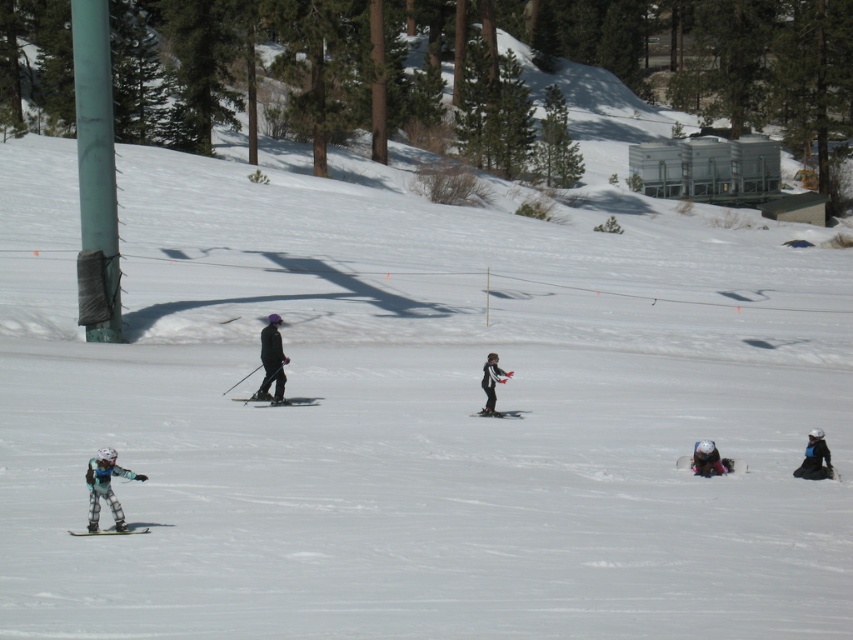
Does white snowsuit at lower right have a lesser width compared to black matte ski at center?

Yes, white snowsuit at lower right is thinner than black matte ski at center.

In the scene shown: Between white snowsuit at lower right and black matte ski at center, which one is positioned higher?

black matte ski at center is higher up.

Does point (709, 465) come farther from viewer compared to point (283, 403)?

That is False.

At what (x,y) coordinates should I click in order to perform the action: click on white snowsuit at lower right. Please return your answer as a coordinate pair (x, y). This screenshot has height=640, width=853. Looking at the image, I should click on (706, 460).

Can you confirm if matte gray ski suit at lower left is wider than white snowsuit at lower right?

Indeed, matte gray ski suit at lower left has a greater width compared to white snowsuit at lower right.

Identify the location of matte gray ski suit at lower left. (105, 486).

Is dark gray ski suit at center smaller than pink fabric ski at lower right?

Incorrect, dark gray ski suit at center is not smaller in size than pink fabric ski at lower right.

Between dark gray ski suit at center and pink fabric ski at lower right, which one appears on the left side from the viewer's perspective?

Positioned to the left is dark gray ski suit at center.

Between point (268, 394) and point (685, 456), which one is positioned in front?

Point (685, 456) is more forward.

Identify the location of dark gray ski suit at center. (271, 360).